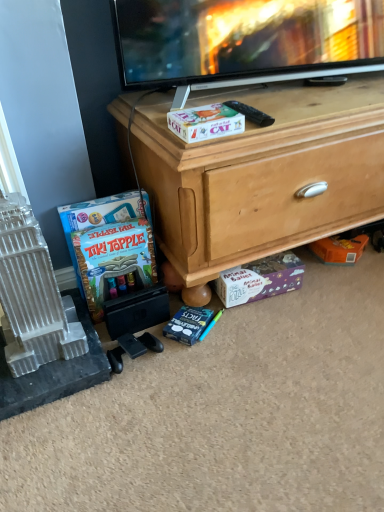
Question: Is white plastic building at left wider or thinner than wooden chest at center?

Choices:
 (A) thin
 (B) wide

Answer: (A)

Question: Do you think white plastic building at left is within wooden chest at center, or outside of it?

Choices:
 (A) inside
 (B) outside

Answer: (B)

Question: Considering the real-world distances, which object is farthest from the white plastic building at left?

Choices:
 (A) wooden chest at center
 (B) black plastic remote control at upper center
 (C) white cardboard box at center
 (D) matte board game at lower left
 (E) purple cardboard puzzle box at lower center

Answer: (B)

Question: Which object is the closest to the black plastic remote control at upper center?

Choices:
 (A) white plastic building at left
 (B) wooden chest at center
 (C) matte board game at lower left
 (D) purple cardboard puzzle box at lower center
 (E) white cardboard box at center

Answer: (E)